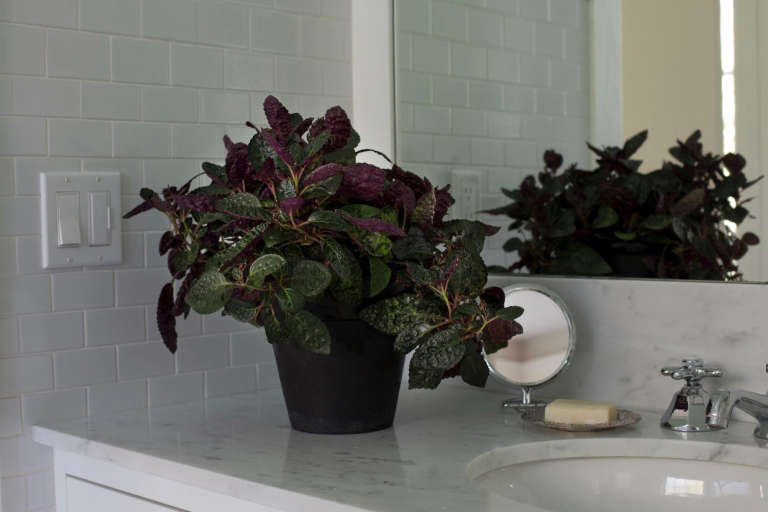
The image size is (768, 512). I want to click on soap, so click(x=565, y=415).